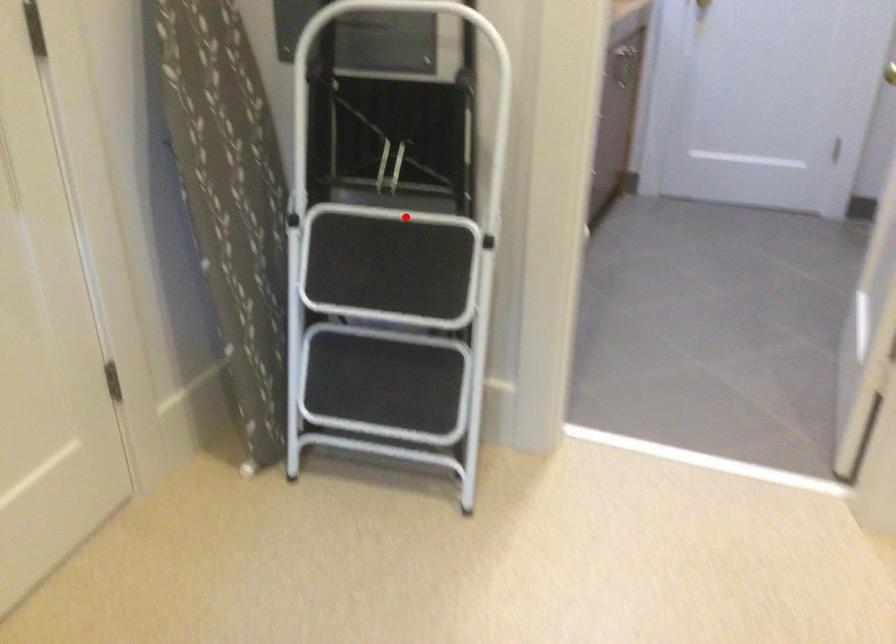
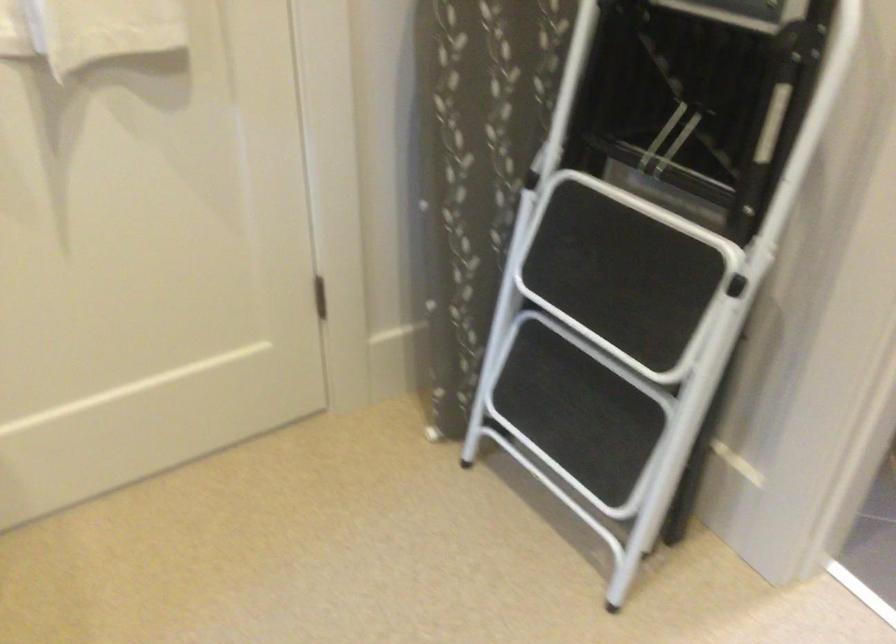
Question: I am providing you with two images of the same scene from different viewpoints. Image1 has a red point marked. In image2, the corresponding 3D location appears at what relative position? Reply with the corresponding letter.

Choices:
 (A) Closer
 (B) Farther

Answer: (A)